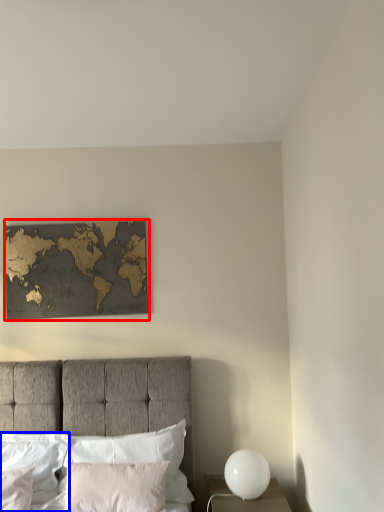
Question: Which object appears closest to the camera in this image, picture frame (highlighted by a red box) or pillow (highlighted by a blue box)?

Choices:
 (A) picture frame
 (B) pillow

Answer: (B)